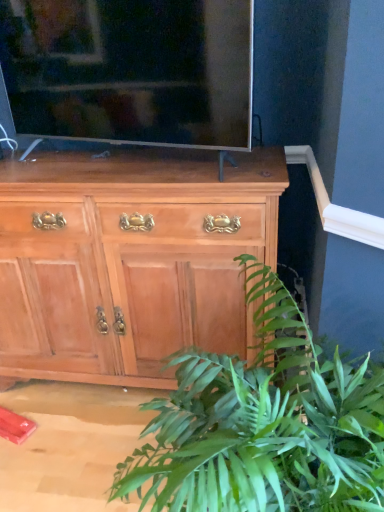
Question: From a real-world perspective, is light brown wood cabinet at center on matte black tv at upper center?

Choices:
 (A) no
 (B) yes

Answer: (A)

Question: Considering the relative sizes of light brown wood cabinet at center and matte black tv at upper center in the image provided, is light brown wood cabinet at center taller than matte black tv at upper center?

Choices:
 (A) no
 (B) yes

Answer: (B)

Question: Is light brown wood cabinet at center at the left side of matte black tv at upper center?

Choices:
 (A) no
 (B) yes

Answer: (B)

Question: Considering the relative positions of light brown wood cabinet at center and matte black tv at upper center in the image provided, is light brown wood cabinet at center in front of matte black tv at upper center?

Choices:
 (A) yes
 (B) no

Answer: (B)

Question: Is matte black tv at upper center located within light brown wood cabinet at center?

Choices:
 (A) yes
 (B) no

Answer: (B)

Question: Is light brown wood cabinet at center far from matte black tv at upper center?

Choices:
 (A) no
 (B) yes

Answer: (A)

Question: Is the depth of green leafy plant at lower right less than that of matte black tv at upper center?

Choices:
 (A) no
 (B) yes

Answer: (B)

Question: Is green leafy plant at lower right not within matte black tv at upper center?

Choices:
 (A) no
 (B) yes

Answer: (B)

Question: Considering the relative positions of green leafy plant at lower right and matte black tv at upper center in the image provided, is green leafy plant at lower right behind matte black tv at upper center?

Choices:
 (A) no
 (B) yes

Answer: (A)

Question: From the image's perspective, is green leafy plant at lower right under matte black tv at upper center?

Choices:
 (A) yes
 (B) no

Answer: (A)

Question: Considering the relative sizes of green leafy plant at lower right and matte black tv at upper center in the image provided, is green leafy plant at lower right taller than matte black tv at upper center?

Choices:
 (A) no
 (B) yes

Answer: (B)

Question: Considering the relative sizes of green leafy plant at lower right and matte black tv at upper center in the image provided, is green leafy plant at lower right bigger than matte black tv at upper center?

Choices:
 (A) yes
 (B) no

Answer: (A)

Question: Is the position of matte black tv at upper center more distant than that of green leafy plant at lower right?

Choices:
 (A) yes
 (B) no

Answer: (A)